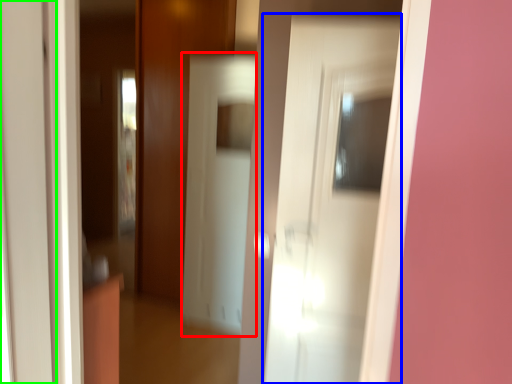
Question: Which is nearer to the screen door (highlighted by a red box)? door (highlighted by a blue box) or door (highlighted by a green box).

Choices:
 (A) door
 (B) door

Answer: (A)